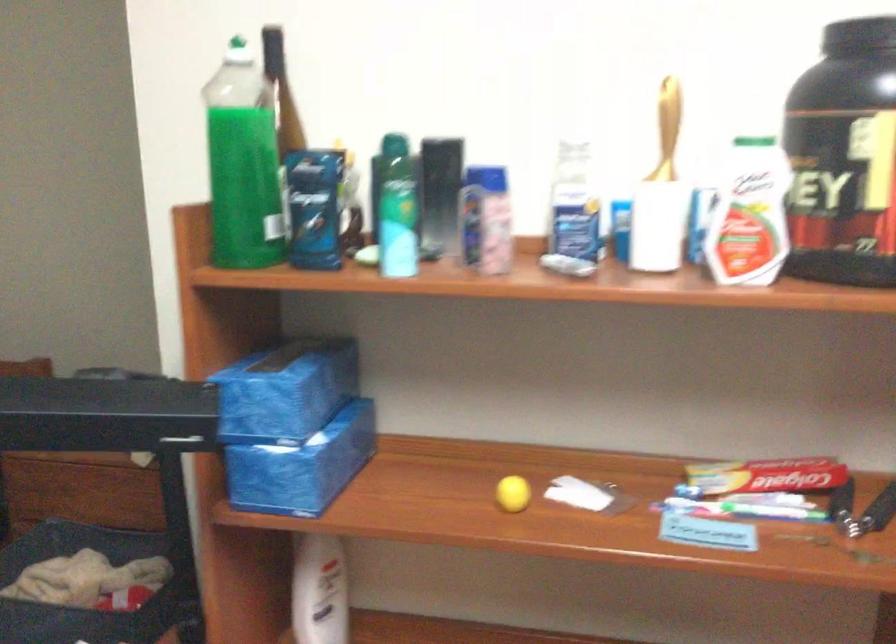
What do you see at coordinates (668, 118) in the screenshot?
I see `the hand grip handle` at bounding box center [668, 118].